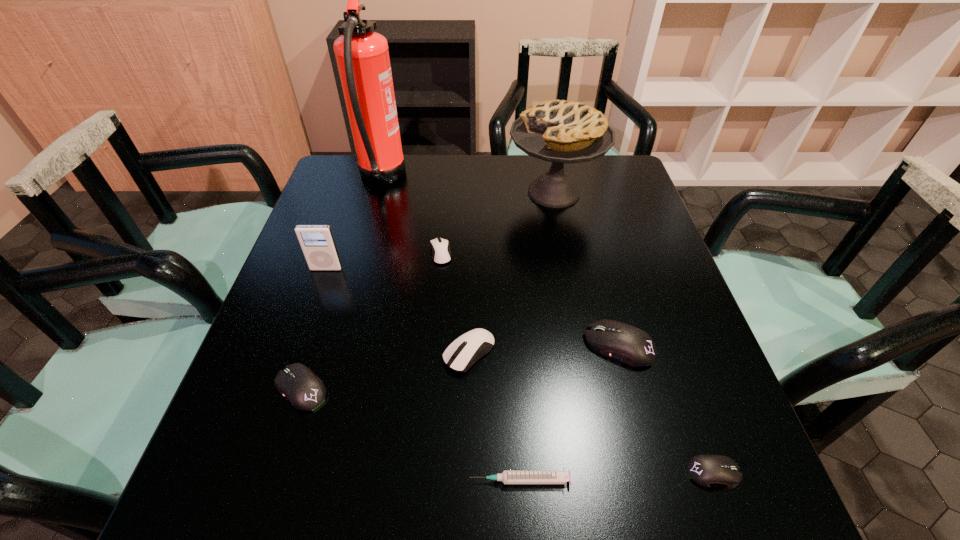
The image size is (960, 540). I want to click on the third farthest object, so click(441, 254).

The height and width of the screenshot is (540, 960). In order to click on the nearest computer equipment in this screenshot , I will do 706,470.

I want to click on the nearest black computer equipment, so [x=706, y=470].

The image size is (960, 540). Find the location of `white syringe`. white syringe is located at coordinates 507,476.

You are a GUI agent. You are given a task and a screenshot of the screen. Output one action in this format:
    pyautogui.click(x=<x>, y=<y>)
    Task: Click on the blank space located 0.280m at the nozzle of the red fire extinguisher
    The image size is (960, 540).
    Given the screenshot: What is the action you would take?
    pyautogui.click(x=496, y=178)

The width and height of the screenshot is (960, 540). Find the location of `vacant space situated 0.340m on the cut side of the pie`. vacant space situated 0.340m on the cut side of the pie is located at coordinates (391, 192).

You are a GUI agent. You are given a task and a screenshot of the screen. Output one action in this format:
    pyautogui.click(x=<x>, y=<y>)
    Task: Click on the vacant space located on the cut side of the pie
    
    Given the screenshot: What is the action you would take?
    pyautogui.click(x=428, y=192)

Image resolution: width=960 pixels, height=540 pixels. I want to click on free region located on the cut side of the pie, so click(439, 192).

Locate an element on the screen. This screenshot has height=540, width=960. free space located on the front-facing side of the iPod is located at coordinates (312, 309).

You are a GUI agent. You are given a task and a screenshot of the screen. Output one action in this format:
    pyautogui.click(x=<x>, y=<y>)
    Task: Click on the vacant area situated on the left of the biggest black computer equipment
    
    Given the screenshot: What is the action you would take?
    pyautogui.click(x=561, y=346)